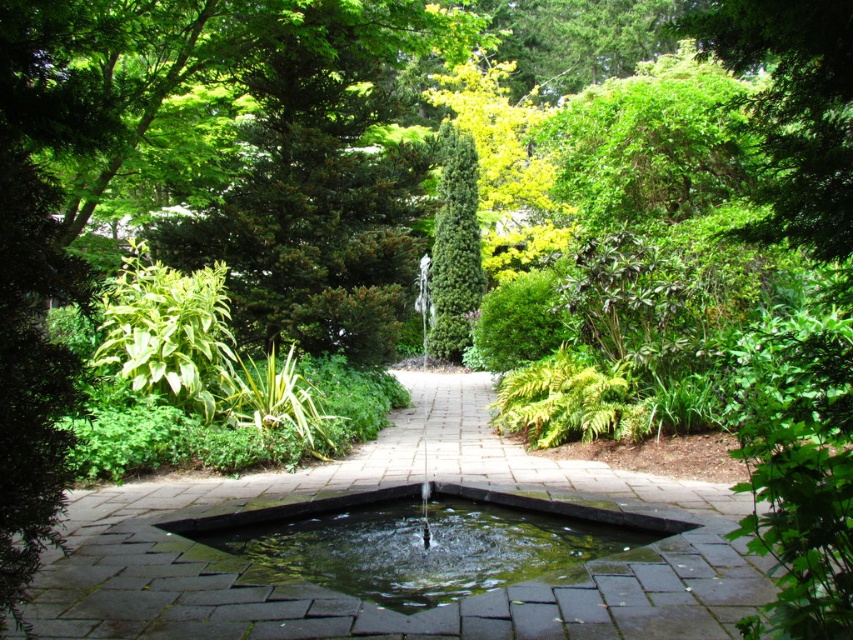
In the scene shown: Is green mossy water at center bigger than green leafy bush at upper left?

No, green mossy water at center is not bigger than green leafy bush at upper left.

Where is `green mossy water at center`? The height and width of the screenshot is (640, 853). green mossy water at center is located at coordinates (422, 541).

Is green leafy bush at upper left in front of green glossy conifer at center?

Yes, green leafy bush at upper left is closer to the viewer.

Who is positioned more to the right, green leafy bush at upper left or green glossy conifer at center?

green glossy conifer at center is more to the right.

Who is more forward, (161, 369) or (450, 141)?

Point (161, 369) is more forward.

Find the location of `green leafy bush at upper left`. green leafy bush at upper left is located at coordinates (171, 333).

Does green mossy water at center have a greater height compared to green glossy conifer at center?

Incorrect, green mossy water at center's height is not larger of green glossy conifer at center's.

Does green mossy water at center have a lesser height compared to green glossy conifer at center?

Yes.

I want to click on green mossy water at center, so click(x=422, y=541).

Identify the location of green mossy water at center. (422, 541).